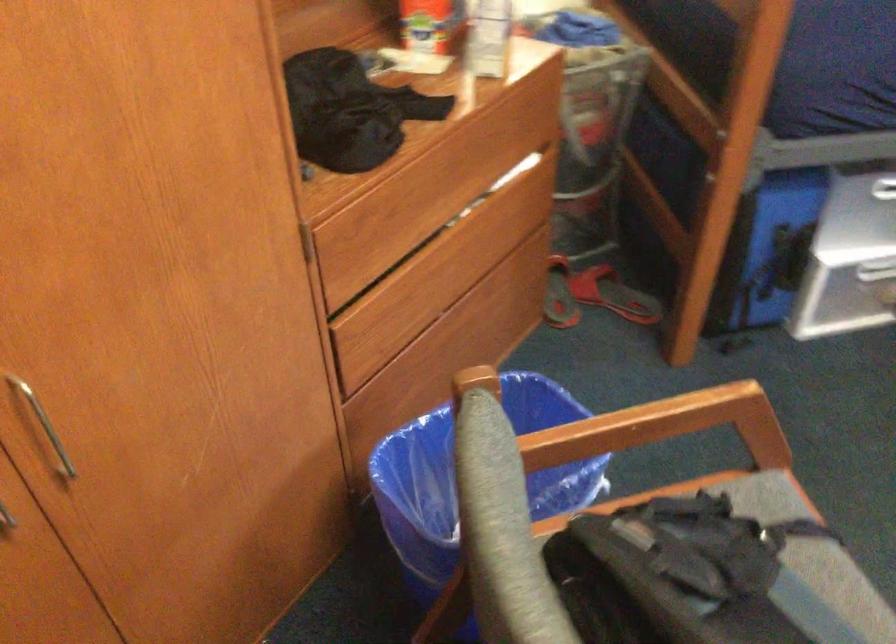
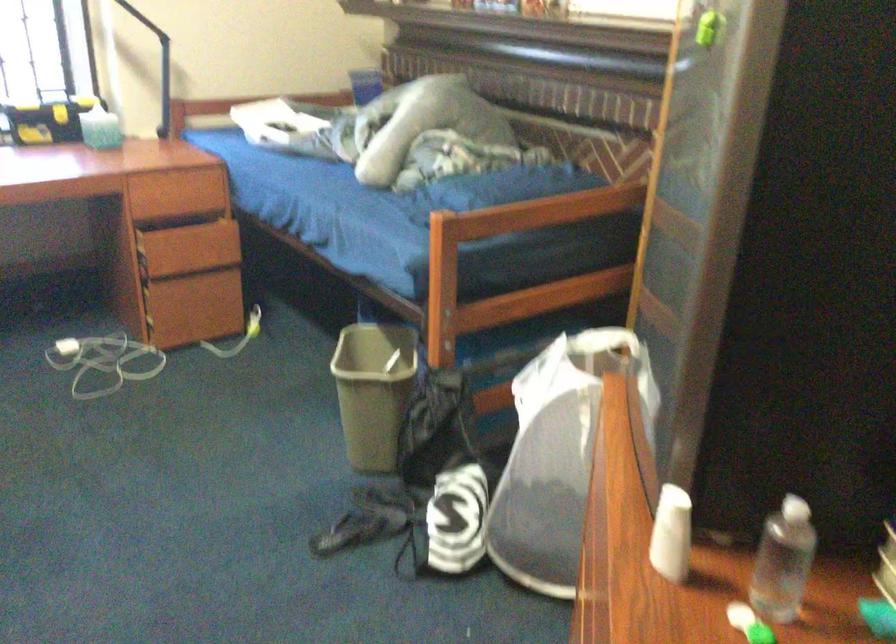
The images are taken continuously from a first-person perspective. In which direction is your viewpoint rotating?

The rotation direction of the camera is right-down.